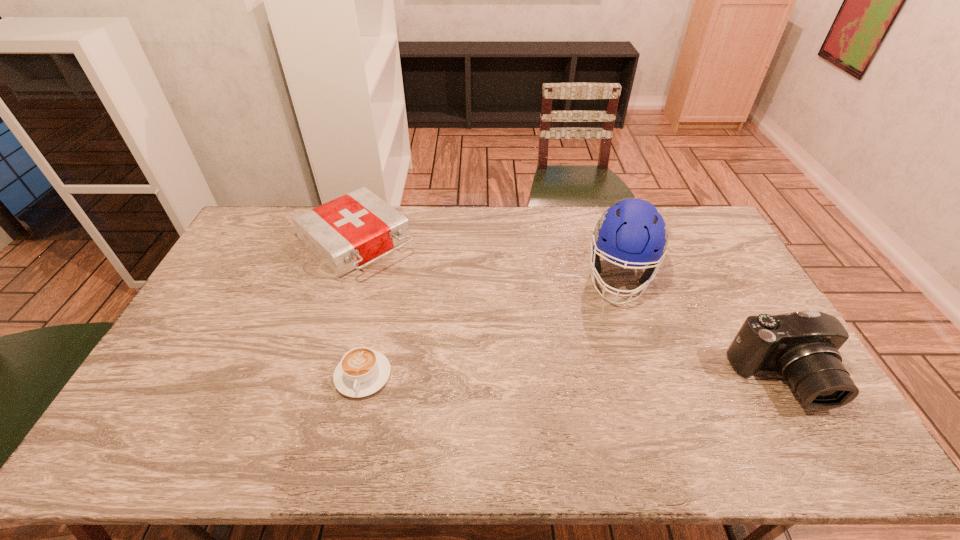
At what (x,y) coordinates should I click in order to perform the action: click on vacant space at the near left corner. Please return your answer as a coordinate pair (x, y). Looking at the image, I should click on pyautogui.click(x=205, y=389).

At what (x,y) coordinates should I click in order to perform the action: click on free space at the far right corner. Please return your answer as a coordinate pair (x, y). Looking at the image, I should click on (711, 234).

The width and height of the screenshot is (960, 540). In order to click on vacant space that is in between the second shortest object and the third shortest object in this screenshot , I will do `click(569, 311)`.

At what (x,y) coordinates should I click in order to perform the action: click on vacant point located between the third object from left to right and the rightmost object. Please return your answer as a coordinate pair (x, y). Looking at the image, I should click on (702, 328).

Where is `vacant point located between the football helmet and the cappuccino`? The image size is (960, 540). vacant point located between the football helmet and the cappuccino is located at coordinates (492, 326).

You are a GUI agent. You are given a task and a screenshot of the screen. Output one action in this format:
    pyautogui.click(x=<x>, y=<y>)
    Task: Click on the vacant point located between the football helmet and the cappuccino
    This screenshot has height=540, width=960.
    Given the screenshot: What is the action you would take?
    pyautogui.click(x=492, y=326)

Locate an element on the screen. The height and width of the screenshot is (540, 960). free space that is in between the first-aid kit and the cappuccino is located at coordinates (360, 309).

Find the location of `vacant region between the tallest object and the third shortest object`. vacant region between the tallest object and the third shortest object is located at coordinates point(702,328).

Find the location of a particular element. free space between the cappuccino and the third tallest object is located at coordinates (360, 309).

The image size is (960, 540). Find the location of `free space between the second shortest object and the cappuccino`. free space between the second shortest object and the cappuccino is located at coordinates (360, 309).